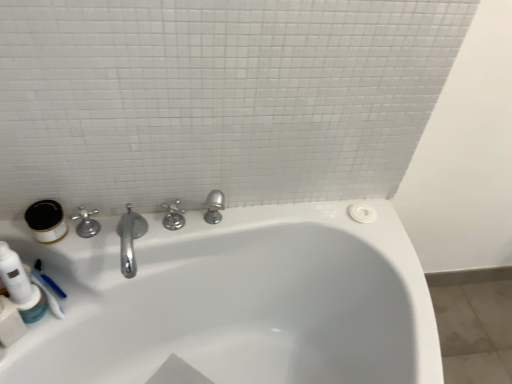
Question: From a real-world perspective, relative to polished chrome faucet at left, placed as the 2th tap when sorted from right to left, is white glossy bathtub at center vertically above or below?

Choices:
 (A) above
 (B) below

Answer: (B)

Question: Looking at their shapes, would you say white glossy bathtub at center is wider or thinner than polished chrome faucet at left, which ranks as the first tap in left-to-right order?

Choices:
 (A) thin
 (B) wide

Answer: (B)

Question: Which of these objects is positioned farthest from the polished chrome faucet at center, which is counted as the 2th tap, starting from the left?

Choices:
 (A) matte white jar at left, the 2th mouthwash positioned from the bottom
 (B) translucent plastic mouthwash at lower left, which ranks as the 1th mouthwash in bottom-to-top order
 (C) white glossy bathtub at center
 (D) polished chrome faucet at left, which ranks as the first tap in left-to-right order

Answer: (C)

Question: Considering the real-world distances, which object is closest to the matte white jar at left, the 2th mouthwash positioned from the bottom?

Choices:
 (A) translucent plastic mouthwash at lower left, arranged as the 2th mouthwash when viewed from the top
 (B) polished chrome faucet at center, which is the 1th tap in right-to-left order
 (C) polished chrome faucet at left, which ranks as the first tap in left-to-right order
 (D) white glossy bathtub at center

Answer: (C)